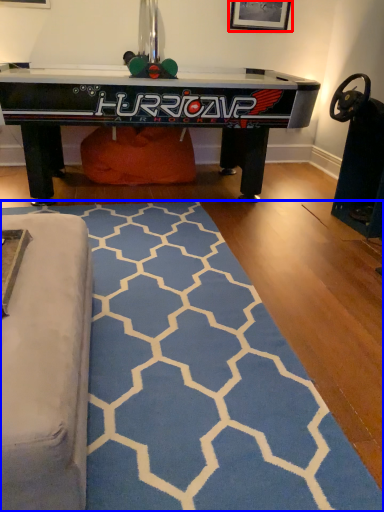
Question: Which object is further to the camera taking this photo, picture frame (highlighted by a red box) or mat (highlighted by a blue box)?

Choices:
 (A) picture frame
 (B) mat

Answer: (A)